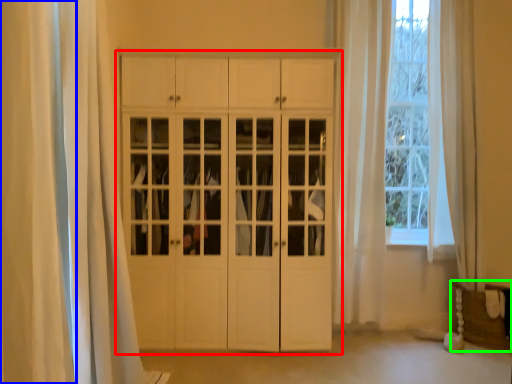
Question: Based on their relative distances, which object is nearer to cupboard (highlighted by a red box)? Choose from curtain (highlighted by a blue box) and furniture (highlighted by a green box).

Choices:
 (A) curtain
 (B) furniture

Answer: (A)